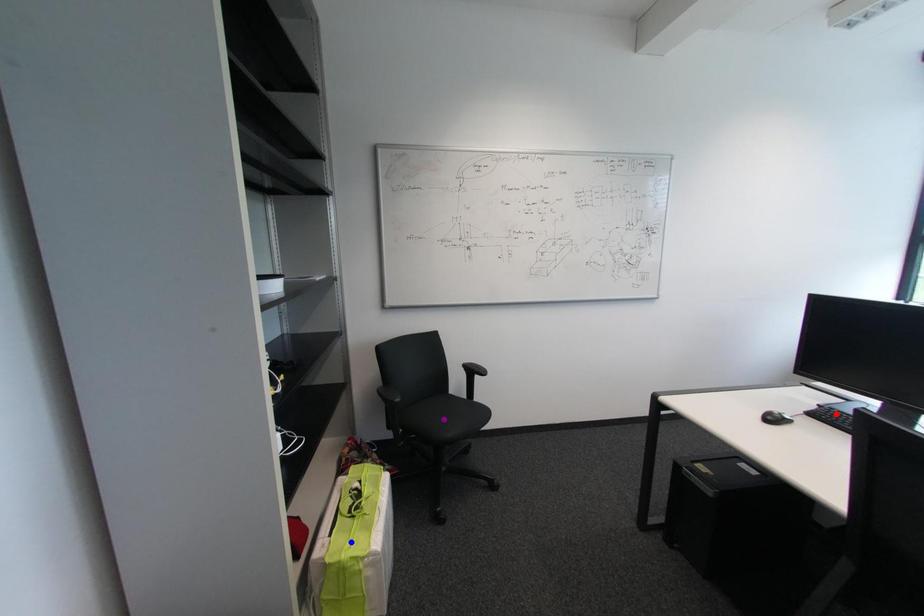
Order these from farthest to nearest:
purple point
red point
blue point

purple point
blue point
red point